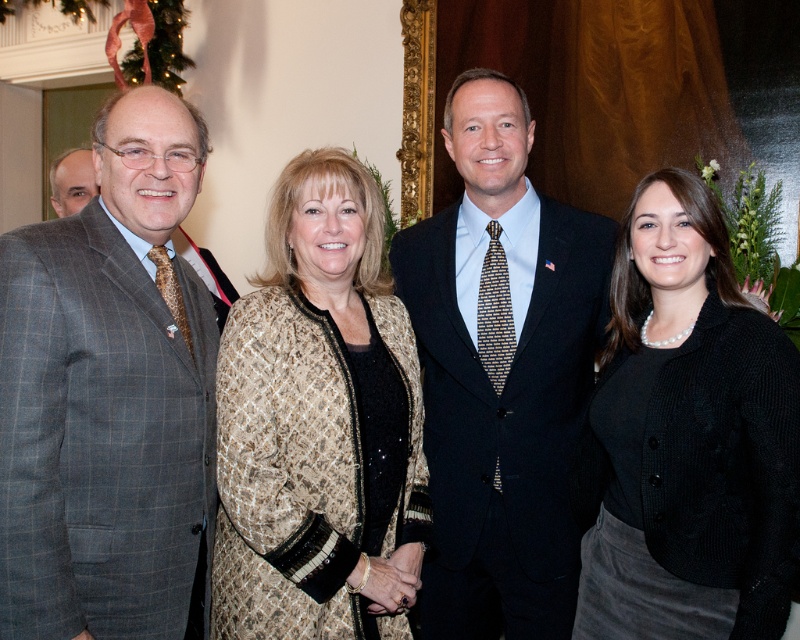
Question: Which point appears closest to the camera in this image?

Choices:
 (A) (62, 381)
 (B) (56, 189)
 (C) (644, 326)

Answer: (A)

Question: In this image, where is dark blue suit at center located relative to matte gray suit at left?

Choices:
 (A) right
 (B) left

Answer: (A)

Question: Considering the relative positions of dark blue suit at center and black wool cardigan at right in the image provided, where is dark blue suit at center located with respect to black wool cardigan at right?

Choices:
 (A) left
 (B) right

Answer: (A)

Question: Which object is the closest to the gray checkered suit at left?

Choices:
 (A) gold textured jacket at center
 (B) matte gray suit at left
 (C) black wool cardigan at right

Answer: (A)

Question: Does gray checkered suit at left have a lesser width compared to gold textured jacket at center?

Choices:
 (A) yes
 (B) no

Answer: (A)

Question: Which of the following is the farthest from the observer?

Choices:
 (A) 308,611
 (B) 708,349

Answer: (B)